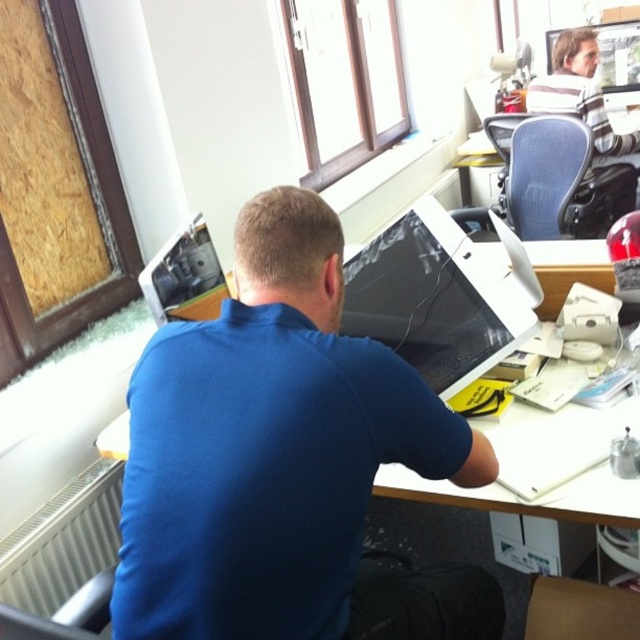
Question: Which object is closer to the camera taking this photo?

Choices:
 (A) matte black monitor at center
 (B) striped cotton shirt at upper right

Answer: (A)

Question: Can you confirm if blue matte shirt at center is smaller than matte black monitor at upper left?

Choices:
 (A) no
 (B) yes

Answer: (A)

Question: Estimate the real-world distances between objects in this image. Which object is closer to the matte black monitor at center?

Choices:
 (A) matte black monitor at upper left
 (B) blue matte shirt at center

Answer: (B)

Question: Where is blue matte shirt at center located in relation to matte black monitor at upper left in the image?

Choices:
 (A) right
 (B) left

Answer: (A)

Question: Which object is the farthest from the blue matte shirt at center?

Choices:
 (A) striped cotton shirt at upper right
 (B) matte black monitor at upper left

Answer: (A)

Question: Does blue matte shirt at center appear under matte black monitor at center?

Choices:
 (A) yes
 (B) no

Answer: (A)